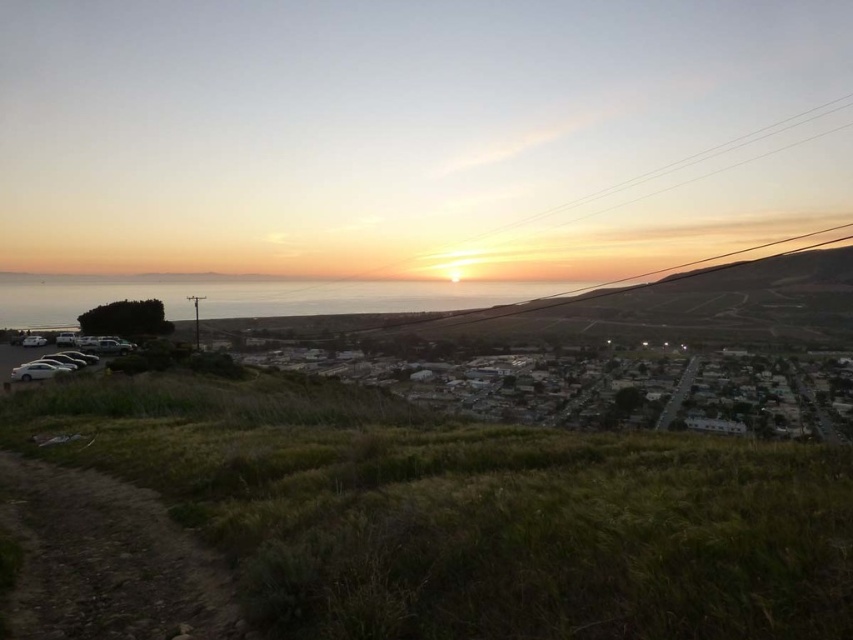
Question: Among these points, which one is farthest from the camera?

Choices:
 (A) (619, 273)
 (B) (125, 380)

Answer: (A)

Question: Is green grassy hillside at lower left closer to the viewer compared to metallic wire at center?

Choices:
 (A) no
 (B) yes

Answer: (B)

Question: Is green grassy hillside at lower left positioned behind metallic wire at center?

Choices:
 (A) no
 (B) yes

Answer: (A)

Question: Is green grassy hillside at lower left thinner than metallic wire at center?

Choices:
 (A) yes
 (B) no

Answer: (A)

Question: Which of the following is the closest to the observer?

Choices:
 (A) (170, 435)
 (B) (498, 241)

Answer: (A)